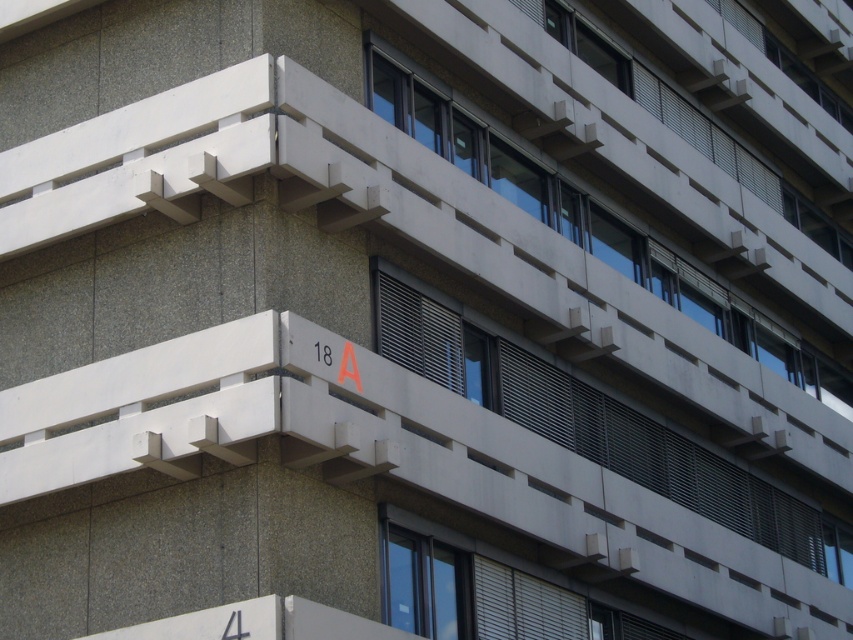
You are an architect reviewing the building design. You need to install a new light fixture between the white textured window at center and the transparent glass window at upper center. Which window should the light fixture be placed closer to?

The light fixture should be placed closer to the transparent glass window at upper center because the white textured window at center is positioned under it.

You are standing in front of the modern building and want to determine the relative positions of two points on its facade. The first point is labeled as point [795,532], and the second is point [440,150]. Which of these points is closer to you?

Point [795,532] is further to the viewer than point [440,150], so the point closer to you is point [440,150].

You are an architect designing a new building and want to place a new window exactly at the same position as the white textured window at center. What are the coordinates of that position?

The coordinates of the white textured window at center are at point (590,422).